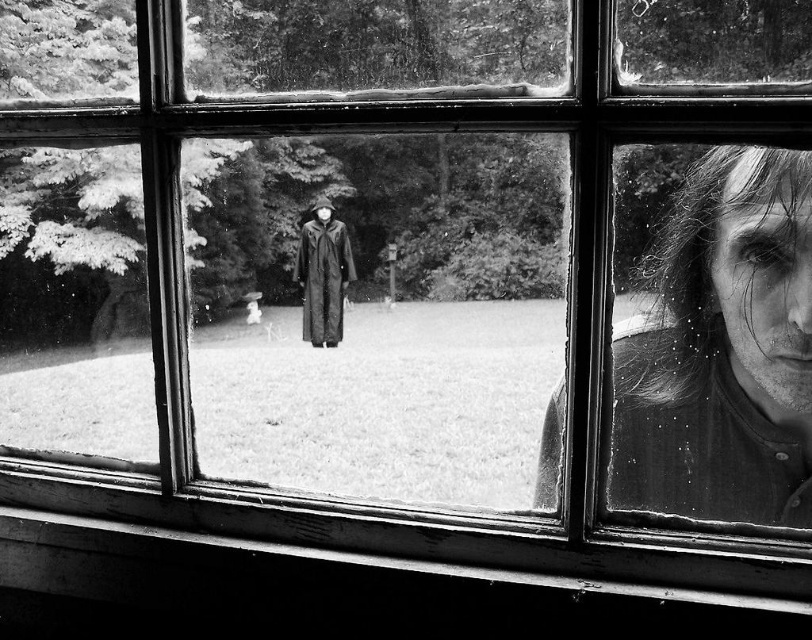
You are a detective examining this photograph. You notice the smooth skin face at right and the matte black robe at center. Based on their positions, which object is closer to the window?

The smooth skin face at right is closer to the window because it is positioned to the right of the matte black robe at center, indicating it is in the foreground.

You are a security camera analyzing the scene. The smooth skin face at right is detected at coordinates. Is it located in the upper half of the image?

The smooth skin face at right is located at point (722, 349). Since the y coordinate 0.890 is greater than 0.5, it is in the upper half of the image.

You are a photographer trying to capture a clear shot of both the smooth skin face at right and the matte black robe at center. Given that your camera has a depth of field that can focus on objects within a 15 inch range, will both subjects be in focus?

The smooth skin face at right is 15.60 inches from matte black robe at center. Since the distance between them exceeds the camera sensor depth of field range of 15 inches, the two subjects will not be in focus simultaneously.